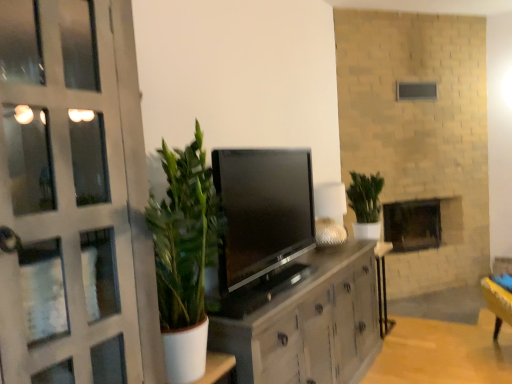
Question: Is satin black tv at center at the left side of brick fireplace at center?

Choices:
 (A) no
 (B) yes

Answer: (B)

Question: Is satin black tv at center positioned with its back to brick fireplace at center?

Choices:
 (A) yes
 (B) no

Answer: (B)

Question: Does satin black tv at center have a greater height compared to brick fireplace at center?

Choices:
 (A) yes
 (B) no

Answer: (A)

Question: From the image's perspective, is satin black tv at center located beneath brick fireplace at center?

Choices:
 (A) no
 (B) yes

Answer: (A)

Question: From a real-world perspective, does satin black tv at center sit lower than brick fireplace at center?

Choices:
 (A) no
 (B) yes

Answer: (A)

Question: Considering their positions, is satin black tv at center located in front of or behind green leafy plant at center?

Choices:
 (A) front
 (B) behind

Answer: (A)

Question: Considering the positions of satin black tv at center and green leafy plant at center in the image, is satin black tv at center taller or shorter than green leafy plant at center?

Choices:
 (A) tall
 (B) short

Answer: (A)

Question: In terms of width, does satin black tv at center look wider or thinner when compared to green leafy plant at center?

Choices:
 (A) wide
 (B) thin

Answer: (B)

Question: Which is correct: satin black tv at center is inside green leafy plant at center, or outside of it?

Choices:
 (A) outside
 (B) inside

Answer: (A)

Question: Is matte white door at left to the left or to the right of green leafy plant at center in the image?

Choices:
 (A) left
 (B) right

Answer: (A)

Question: Is matte white door at left situated inside green leafy plant at center or outside?

Choices:
 (A) inside
 (B) outside

Answer: (B)

Question: From a real-world perspective, is matte white door at left above or below green leafy plant at center?

Choices:
 (A) below
 (B) above

Answer: (B)

Question: Is matte white door at left bigger or smaller than green leafy plant at center?

Choices:
 (A) small
 (B) big

Answer: (B)

Question: Visually, is matte white door at left positioned to the left or to the right of wooden table at center?

Choices:
 (A) left
 (B) right

Answer: (A)

Question: Is matte white door at left wider or thinner than wooden table at center?

Choices:
 (A) thin
 (B) wide

Answer: (B)